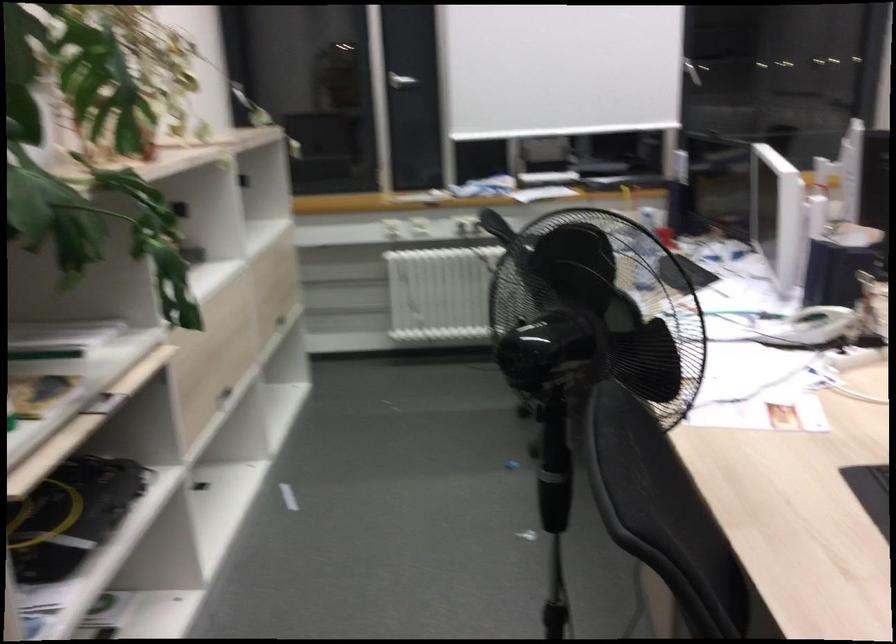
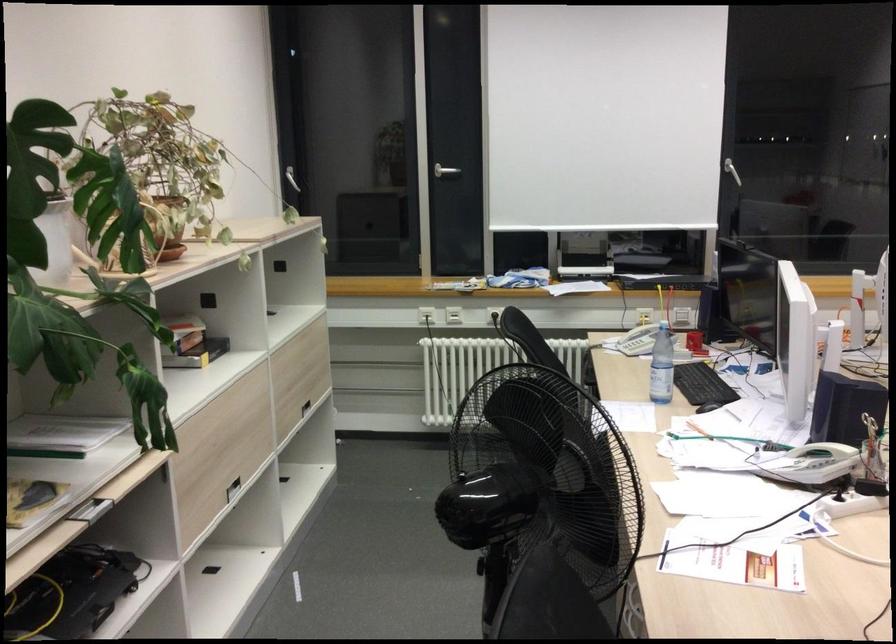
Where in the second image is the point corresponding to [683,70] from the first image?

(731, 171)